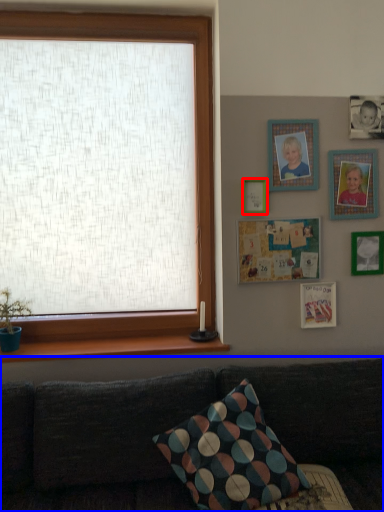
Question: Which point is further to the camera, picture frame (highlighted by a red box) or studio couch (highlighted by a blue box)?

Choices:
 (A) picture frame
 (B) studio couch

Answer: (A)